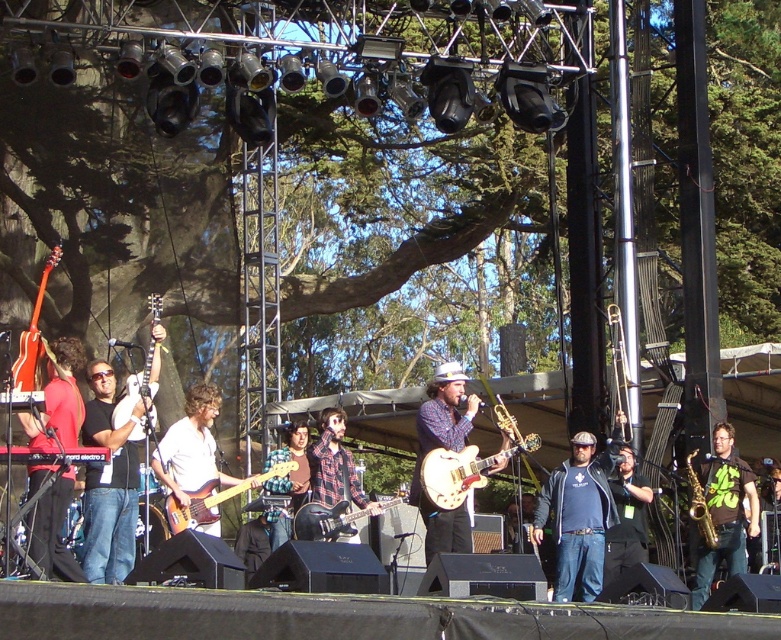
Question: Does white matte guitar at center have a greater width compared to matte brown electric guitar at center?

Choices:
 (A) no
 (B) yes

Answer: (B)

Question: Does white matte guitar at center appear on the left side of plaid fabric guitar at center?

Choices:
 (A) yes
 (B) no

Answer: (A)

Question: Is white matte guitar at center wider than plaid shirt at center?

Choices:
 (A) yes
 (B) no

Answer: (A)

Question: Which point is closer to the camera?

Choices:
 (A) plaid fabric guitar at center
 (B) matte electric guitar at left
 (C) blue denim jeans at center

Answer: (B)

Question: Which point is farther from the camera taking this photo?

Choices:
 (A) (375, 515)
 (B) (286, 429)
 (C) (289, 460)
 (D) (59, 252)

Answer: (B)

Question: Which of the following is the closest to the observer?

Choices:
 (A) black matte guitar at left
 (B) green matte t-shirt at lower right

Answer: (A)